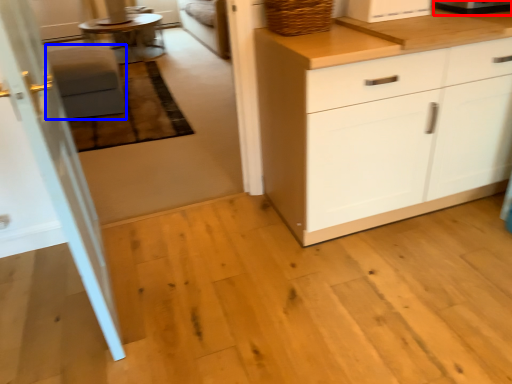
Question: Which of the following is the closest to the observer, appliance (highlighted by a red box) or stool (highlighted by a blue box)?

Choices:
 (A) appliance
 (B) stool

Answer: (A)